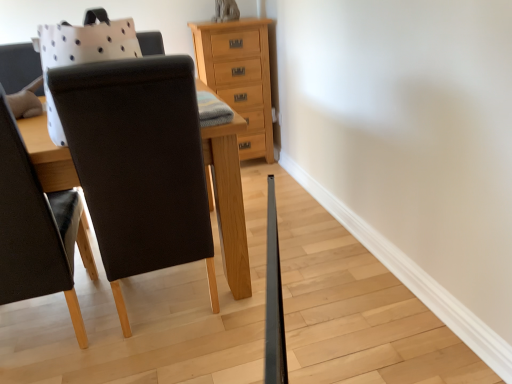
Where is `vacant space to the right of wooden table at center`? This screenshot has width=512, height=384. vacant space to the right of wooden table at center is located at coordinates (297, 285).